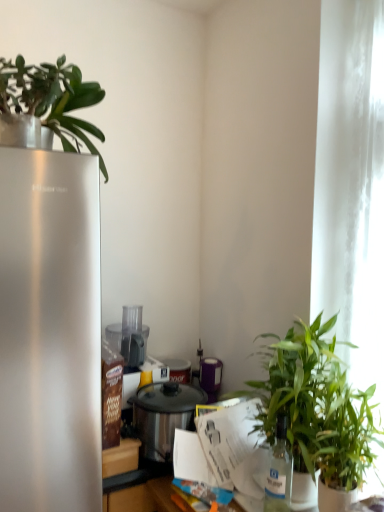
Question: From a real-world perspective, is clear glass bottle at lower right on top of green leafy plant at right, the second houseplant in the left-to-right sequence?

Choices:
 (A) yes
 (B) no

Answer: (B)

Question: Is clear glass bottle at lower right at the right side of green leafy plant at right, the second houseplant when ordered from bottom to top?

Choices:
 (A) yes
 (B) no

Answer: (B)

Question: Is the position of clear glass bottle at lower right more distant than that of green leafy plant at right, the 2th houseplant in the right-to-left sequence?

Choices:
 (A) yes
 (B) no

Answer: (A)

Question: Is clear glass bottle at lower right next to green leafy plant at right, the second houseplant in the left-to-right sequence?

Choices:
 (A) yes
 (B) no

Answer: (B)

Question: Does clear glass bottle at lower right have a greater height compared to green leafy plant at right, placed as the 2th houseplant when sorted from top to bottom?

Choices:
 (A) yes
 (B) no

Answer: (B)

Question: Can you confirm if clear glass bottle at lower right is positioned to the left of green leafy plant at right, placed as the 2th houseplant when sorted from top to bottom?

Choices:
 (A) no
 (B) yes

Answer: (B)

Question: Can you confirm if white ceramic pot at lower right is wider than clear glass bottle at lower right?

Choices:
 (A) no
 (B) yes

Answer: (B)

Question: Does white ceramic pot at lower right turn towards clear glass bottle at lower right?

Choices:
 (A) no
 (B) yes

Answer: (A)

Question: From a real-world perspective, is white ceramic pot at lower right located higher than clear glass bottle at lower right?

Choices:
 (A) yes
 (B) no

Answer: (B)

Question: From a real-world perspective, does white ceramic pot at lower right sit lower than clear glass bottle at lower right?

Choices:
 (A) yes
 (B) no

Answer: (A)

Question: Considering the relative positions of white ceramic pot at lower right and clear glass bottle at lower right in the image provided, is white ceramic pot at lower right in front of clear glass bottle at lower right?

Choices:
 (A) yes
 (B) no

Answer: (A)

Question: Can you confirm if white ceramic pot at lower right is taller than clear glass bottle at lower right?

Choices:
 (A) yes
 (B) no

Answer: (B)

Question: Considering the relative positions of green leafy plant at right, the 1th houseplant positioned from the right, and white glossy paper at center in the image provided, is green leafy plant at right, the 1th houseplant positioned from the right, behind white glossy paper at center?

Choices:
 (A) no
 (B) yes

Answer: (A)